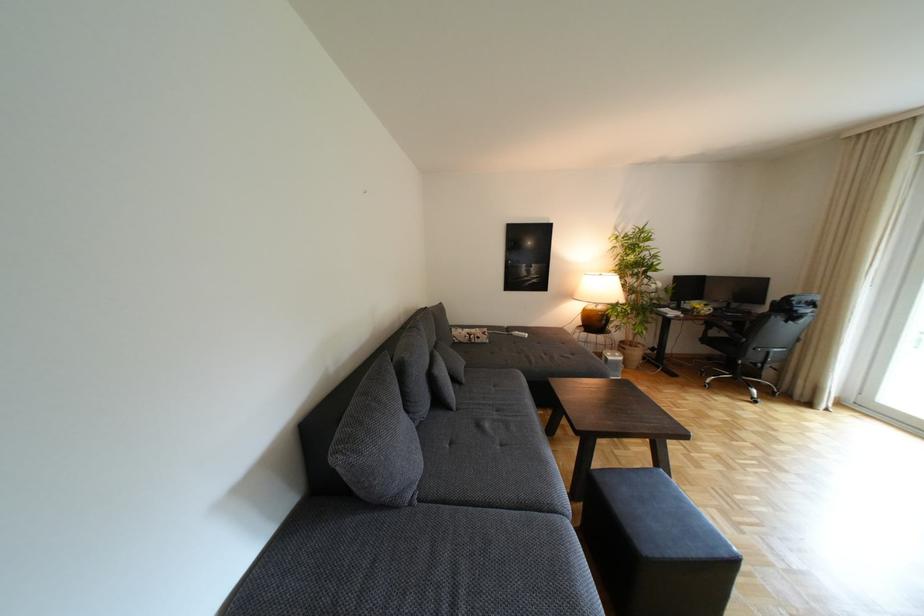
Where would you sit the sofa sitting surface? Please return your answer as a coordinate pair (x, y).

(490, 447)